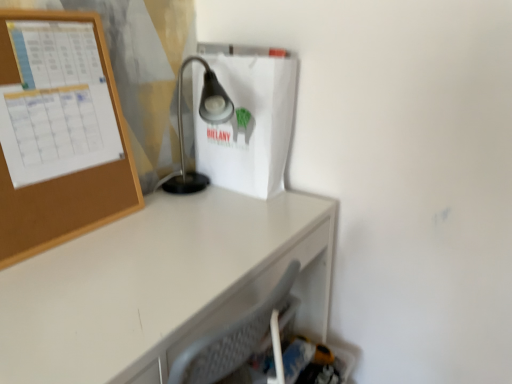
Locate an element on the screen. The width and height of the screenshot is (512, 384). white glossy desk at center is located at coordinates (161, 285).

The height and width of the screenshot is (384, 512). Describe the element at coordinates (248, 123) in the screenshot. I see `white matte paper bag at center` at that location.

Image resolution: width=512 pixels, height=384 pixels. What do you see at coordinates (62, 177) in the screenshot? I see `corkboard at upper left` at bounding box center [62, 177].

Find the location of `white glossy desk at center`. white glossy desk at center is located at coordinates (161, 285).

Based on their sizes in the image, would you say white matte paper bag at center is bigger or smaller than satin black lamp at center?

Considering their sizes, white matte paper bag at center takes up less space than satin black lamp at center.

Are white matte paper bag at center and satin black lamp at center located far from each other?

No, white matte paper bag at center is not far away from satin black lamp at center.

Is satin black lamp at center at the back of white matte paper bag at center?

Yes.

From a real-world perspective, is white matte paper bag at center physically located above or below satin black lamp at center?

white matte paper bag at center is situated higher than satin black lamp at center in the real world.

Is white matte paper bag at center looking in the opposite direction of white glossy desk at center?

No, white matte paper bag at center's orientation is not away from white glossy desk at center.

Is white matte paper bag at center not close to white glossy desk at center?

white matte paper bag at center is actually quite close to white glossy desk at center.

Looking at this image, how many degrees apart are the facing directions of white matte paper bag at center and white glossy desk at center?

white matte paper bag at center and white glossy desk at center are facing 85.2 degrees away from each other.

From the image's perspective, which is above, white matte paper bag at center or white glossy desk at center?

white matte paper bag at center.

How different are the orientations of white glossy desk at center and white matte paper bag at center in degrees?

They differ by 85.2 degrees in their facing directions.

Considering the positions of objects white glossy desk at center and white matte paper bag at center in the image provided, who is behind, white glossy desk at center or white matte paper bag at center?

white matte paper bag at center is more distant.

Looking at this image, considering the relative sizes of white glossy desk at center and white matte paper bag at center in the image provided, is white glossy desk at center thinner than white matte paper bag at center?

No, white glossy desk at center is not thinner than white matte paper bag at center.

Which of these two, white glossy desk at center or white matte paper bag at center, is smaller?

Smaller between the two is white matte paper bag at center.

Considering the relative positions of white glossy desk at center and corkboard at upper left in the image provided, is white glossy desk at center to the left or to the right of corkboard at upper left?

From the image, it's evident that white glossy desk at center is to the right of corkboard at upper left.

Is white glossy desk at center positioned with its back to corkboard at upper left?

No, white glossy desk at center's orientation is not away from corkboard at upper left.

Is white glossy desk at center behind corkboard at upper left?

No, white glossy desk at center is closer to the viewer.

Does white glossy desk at center have a greater height compared to corkboard at upper left?

Yes.

Between satin black lamp at center and white matte paper bag at center, which one appears on the left side from the viewer's perspective?

satin black lamp at center is more to the left.

Can you tell me how much satin black lamp at center and white matte paper bag at center differ in facing direction?

59.6 degrees.

From a real-world perspective, which is physically below, satin black lamp at center or white matte paper bag at center?

satin black lamp at center, from a real-world perspective.

From the image's perspective, is white matte paper bag at center under corkboard at upper left?

Incorrect, from the image's perspective, white matte paper bag at center is higher than corkboard at upper left.

From a real-world perspective, between white matte paper bag at center and corkboard at upper left, who is vertically lower?

white matte paper bag at center.

Is white matte paper bag at center facing away from corkboard at upper left?

No, white matte paper bag at center is not facing the opposite direction of corkboard at upper left.

Considering the points (254, 68) and (110, 73), which point is behind, point (254, 68) or point (110, 73)?

The point (254, 68) is more distant.

From a real-world perspective, relative to satin black lamp at center, is corkboard at upper left vertically above or below?

In terms of real-world spatial position, corkboard at upper left is above satin black lamp at center.

From the image's perspective, which object appears higher, corkboard at upper left or satin black lamp at center?

satin black lamp at center is shown above in the image.

I want to click on lamp above the corkboard at upper left (from the image's perspective), so click(203, 119).

Does corkboard at upper left appear on the left side of satin black lamp at center?

Yes, corkboard at upper left is to the left of satin black lamp at center.

You are a GUI agent. You are given a task and a screenshot of the screen. Output one action in this format:
    pyautogui.click(x=<x>, y=<y>)
    Task: Click on the lamp in front of the white matte paper bag at center
    
    Given the screenshot: What is the action you would take?
    pyautogui.click(x=203, y=119)

What are the coordinates of `paper bag that is behind the white glossy desk at center` in the screenshot? It's located at (248, 123).

From the image, which object appears to be farther from corkboard at upper left, satin black lamp at center or white glossy desk at center?

Among the two, satin black lamp at center is located further to corkboard at upper left.

Considering their positions, is white glossy desk at center positioned closer to corkboard at upper left than satin black lamp at center?

white glossy desk at center.

Looking at this image, based on their spatial positions, is corkboard at upper left or satin black lamp at center further from white glossy desk at center?

Based on the image, satin black lamp at center appears to be further to white glossy desk at center.

When comparing their distances from white matte paper bag at center, does corkboard at upper left or satin black lamp at center seem further?

corkboard at upper left lies further to white matte paper bag at center than the other object.

Considering their positions, is white glossy desk at center positioned further to satin black lamp at center than white matte paper bag at center?

white glossy desk at center is further to satin black lamp at center.

Estimate the real-world distances between objects in this image. Which object is closer to satin black lamp at center, white matte paper bag at center or corkboard at upper left?

The object closer to satin black lamp at center is white matte paper bag at center.

From the image, which object appears to be nearer to satin black lamp at center, white matte paper bag at center or white glossy desk at center?

white matte paper bag at center is positioned closer to the anchor satin black lamp at center.

Looking at the image, which one is located closer to white matte paper bag at center, satin black lamp at center or white glossy desk at center?

satin black lamp at center is closer to white matte paper bag at center.

The height and width of the screenshot is (384, 512). Find the location of `lamp between white matte paper bag at center and white glossy desk at center in the vertical direction`. lamp between white matte paper bag at center and white glossy desk at center in the vertical direction is located at coordinates (203, 119).

Locate an element on the screen. The width and height of the screenshot is (512, 384). bulletin board that lies between satin black lamp at center and white glossy desk at center from top to bottom is located at coordinates 62,177.

Where is `bulletin board that lies between white matte paper bag at center and white glossy desk at center from top to bottom`? bulletin board that lies between white matte paper bag at center and white glossy desk at center from top to bottom is located at coordinates pyautogui.click(x=62, y=177).

I want to click on lamp located between corkboard at upper left and white matte paper bag at center in the left-right direction, so click(x=203, y=119).